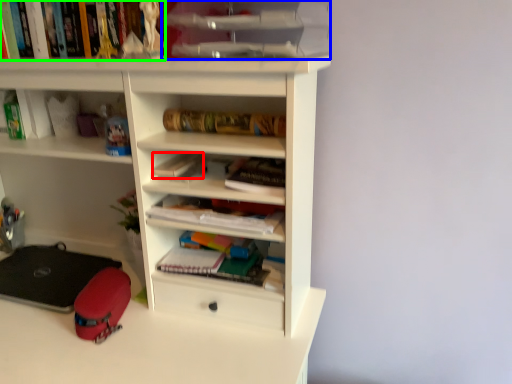
Question: Which is farther away from paperback book (highlighted by a red box)? cabinet (highlighted by a blue box) or book (highlighted by a green box)?

Choices:
 (A) cabinet
 (B) book

Answer: (B)